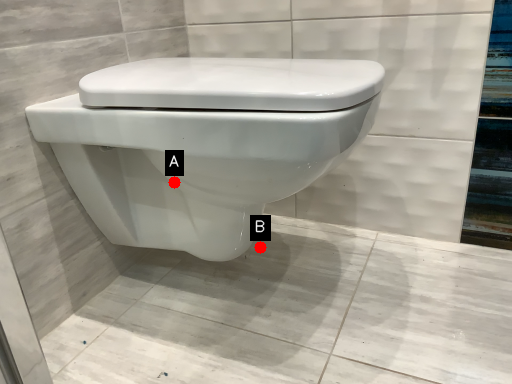
Question: Two points are circled on the image, labeled by A and B beside each circle. Which point is further to the camera?

Choices:
 (A) A is further
 (B) B is further

Answer: (B)